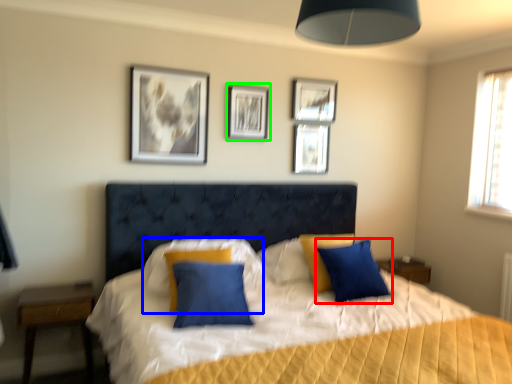
Question: Estimate the real-world distances between objects in this image. Which object is closer to pillow (highlighted by a red box), pillow (highlighted by a blue box) or picture frame (highlighted by a green box)?

Choices:
 (A) pillow
 (B) picture frame

Answer: (A)